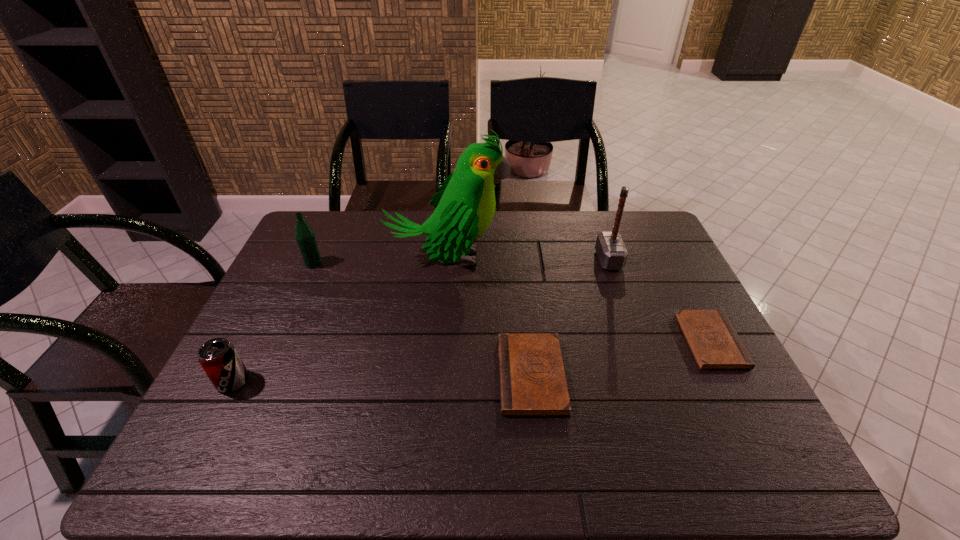
The width and height of the screenshot is (960, 540). I want to click on hammer that is at the far edge, so click(611, 251).

Where is `parakeet that is at the far edge`? parakeet that is at the far edge is located at coordinates (465, 204).

At what (x,y) coordinates should I click in order to perform the action: click on diary at the near edge. Please return your answer as a coordinate pair (x, y). This screenshot has height=540, width=960. Looking at the image, I should click on (532, 380).

This screenshot has height=540, width=960. What are the coordinates of `soda can present at the near edge` in the screenshot? It's located at (218, 357).

Find the location of a particular element. bottle positioned at the left edge is located at coordinates (304, 234).

Identify the location of soda can present at the left edge. This screenshot has height=540, width=960. (218, 357).

You are a GUI agent. You are given a task and a screenshot of the screen. Output one action in this format:
    pyautogui.click(x=<x>, y=<y>)
    Task: Click on the object present at the right edge
    
    Given the screenshot: What is the action you would take?
    pyautogui.click(x=713, y=341)

Identify the location of object that is at the near left corner. (218, 357).

I want to click on vacant space at the far edge, so click(428, 215).

This screenshot has height=540, width=960. In the image, there is a desktop. In order to click on blank space at the near edge in this screenshot , I will do `click(437, 407)`.